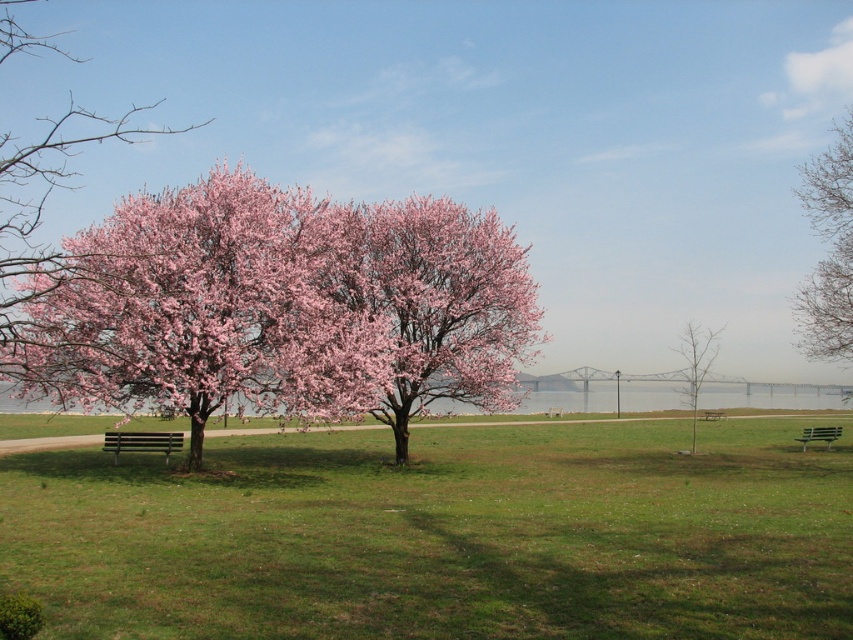
Question: Which of the following is the closest to the observer?

Choices:
 (A) (115, 444)
 (B) (688, 339)

Answer: (A)

Question: Which point appears closest to the camera in this image?

Choices:
 (A) (328, 618)
 (B) (706, 416)
 (C) (827, 289)

Answer: (A)

Question: In this image, where is bare branches at upper right located relative to bare wood tree at center?

Choices:
 (A) above
 (B) below

Answer: (A)

Question: Where is pink bloom at center located in relation to pink bloom tree at left in the image?

Choices:
 (A) left
 (B) right

Answer: (B)

Question: Is pink bloom at center smaller than bare wood tree at center?

Choices:
 (A) yes
 (B) no

Answer: (A)

Question: Which of the following is the farthest from the observer?

Choices:
 (A) (302, 448)
 (B) (115, 445)
 (C) (24, 179)

Answer: (C)